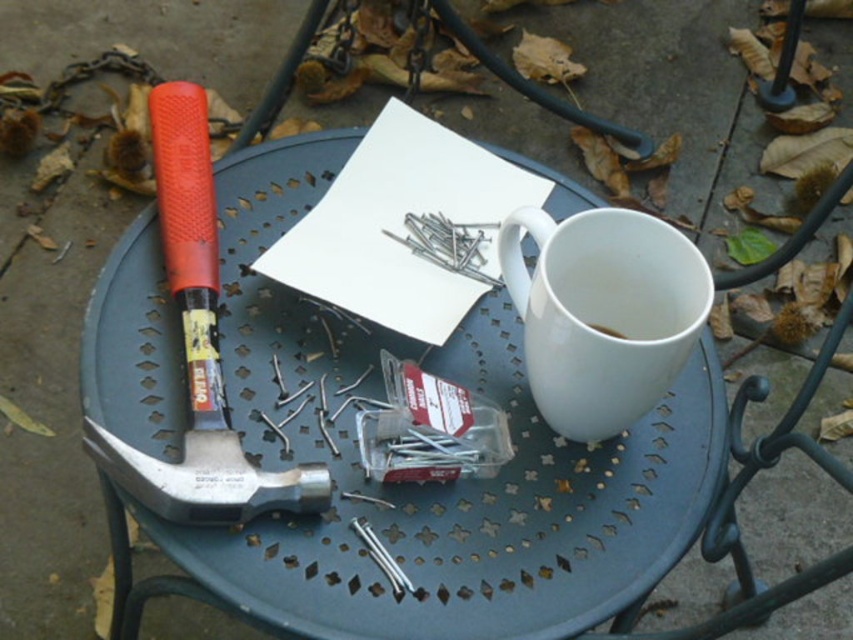
You need to choose between the rubberized metal hammer at left and the white matte cup at upper right to carry a small object. Which object can carry the item more securely?

The rubberized metal hammer at left has a larger size compared to the white matte cup at upper right, so it can carry the item more securely.

Consider the image. You are standing at the center of the patio and see two points marked on the ground. The first point is at coordinates point (650, 333) and the second point is at point (616, 336). Which point is closer to you?

Point (650, 333) is in front of point (616, 336), so it is closer to you.

You are organizing tools on a table. You have a metallic gray table at center and a rubberized metal hammer at left. Where should you place the hammer to ensure it is positioned to the right of its current location?

The rubberized metal hammer at left is currently to the left of the metallic gray table at center. To move it to the right of its current position, you would place it somewhere between its current location and the table, ensuring it remains to the right of where it was originally.